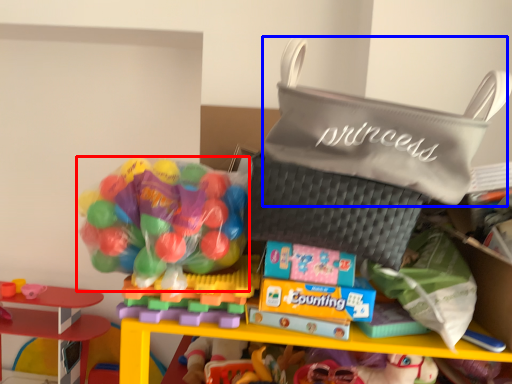
Question: Which of the following is the closest to the observer, candy (highlighted by a red box) or pouch (highlighted by a blue box)?

Choices:
 (A) candy
 (B) pouch

Answer: (B)